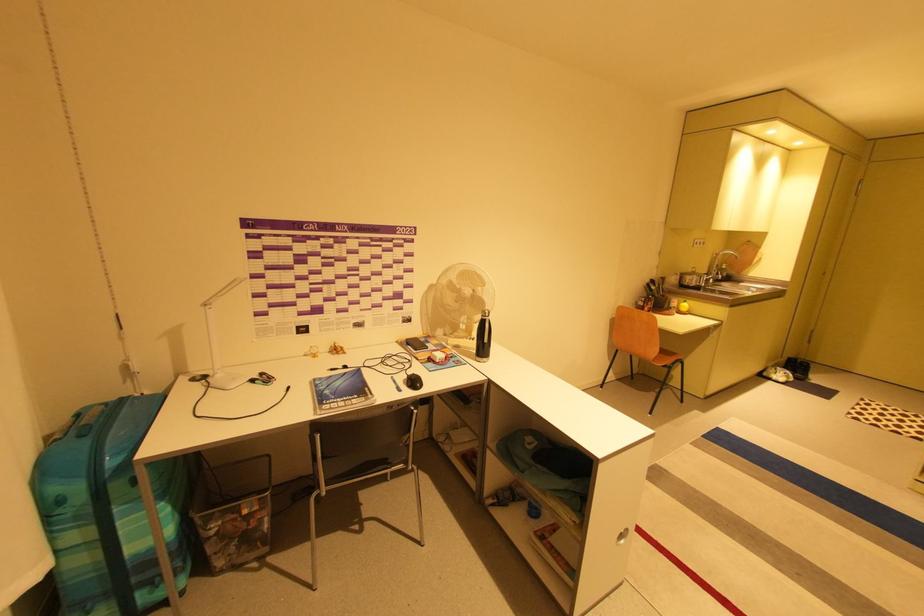
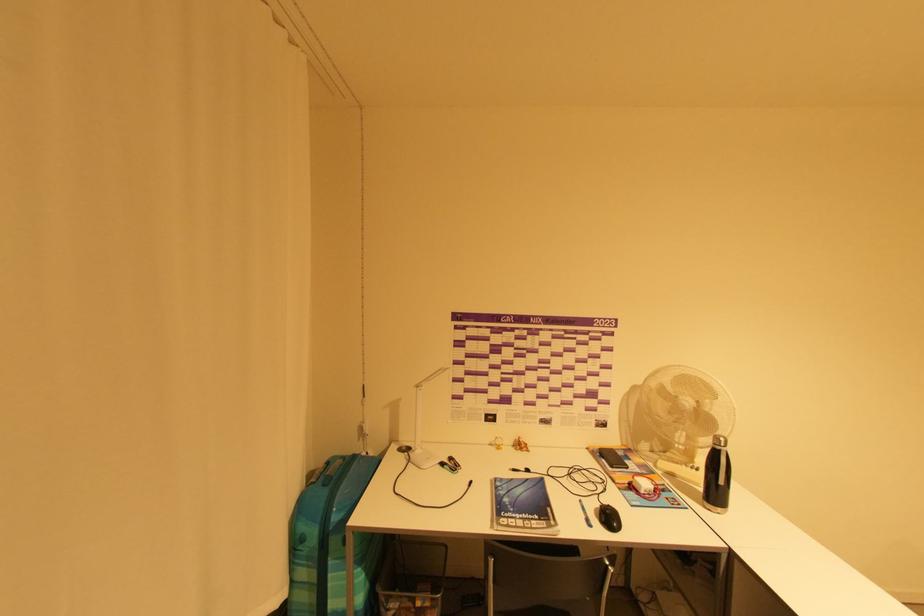
Question: The first image is from the beginning of the video and the second image is from the end. How did the camera likely rotate when shooting the video?

Choices:
 (A) Left
 (B) Right
 (C) Up
 (D) Down

Answer: (A)